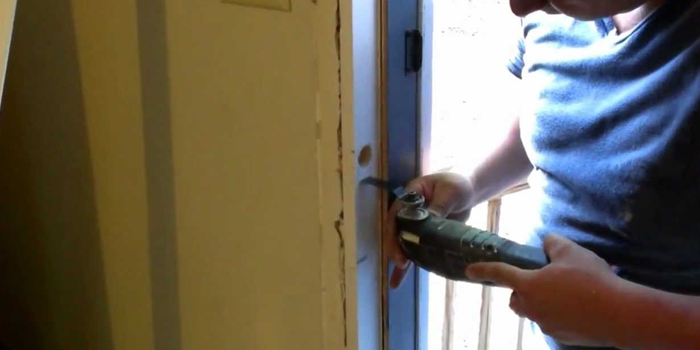
The image size is (700, 350). Identify the location of white edge of wall. (365, 115).